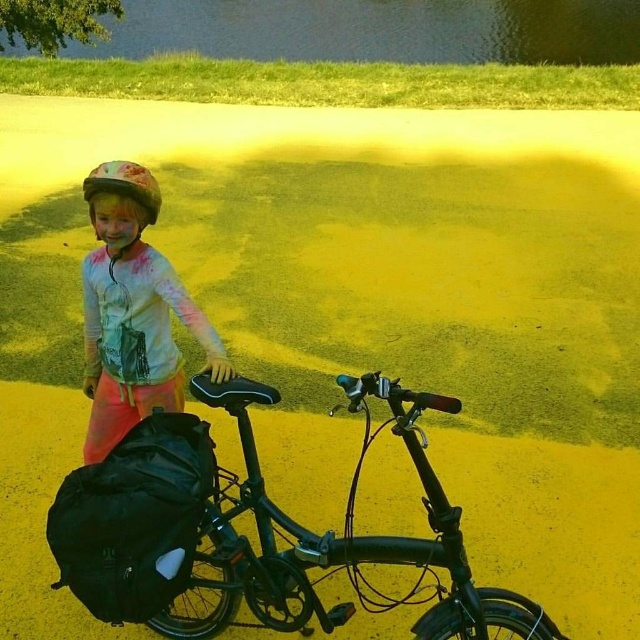
You are a photographer trying to capture the child in the scene. You notice the white matte shirt at upper left and the matte white helmet at center. Which object should you focus on if you want to capture the one that is taller?

The white matte shirt at upper left is taller than the matte white helmet at center, so you should focus on the white matte shirt at upper left.

You are a painter who needs to place a 14 inch wide canvas between the white matte shirt at upper left and the matte white helmet at center. Can you fit it there?

The distance between the white matte shirt at upper left and the matte white helmet at center is 12.39 inches, which is less than the 14 inch width of the canvas. Therefore, the canvas cannot fit in that space.